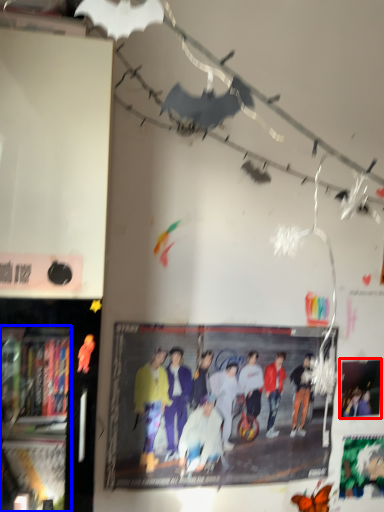
Question: Which object appears closest to the camera in this image, poster page (highlighted by a red box) or bookshelf (highlighted by a blue box)?

Choices:
 (A) poster page
 (B) bookshelf

Answer: (B)